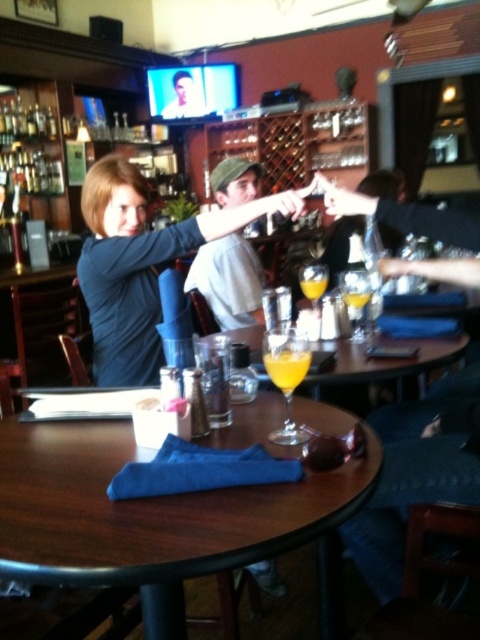
Which is in front, point (86, 284) or point (280, 369)?

Point (280, 369)

Who is more distant from viewer, [139,292] or [263,355]?

Point [139,292]

The height and width of the screenshot is (640, 480). I want to click on matte blue shirt at center, so click(140, 266).

Is point (127, 349) farther from viewer compared to point (240, 310)?

That is False.

Describe the element at coordinates (140, 266) in the screenshot. I see `matte blue shirt at center` at that location.

Who is more forward, (101, 330) or (231, 193)?

Point (101, 330) is more forward.

Image resolution: width=480 pixels, height=640 pixels. I want to click on matte blue shirt at center, so click(140, 266).

Is translucent glass at table center positioned behind orange liquid glass at table center?

No, translucent glass at table center is closer to the viewer.

Does translucent glass at table center have a greater width compared to orange liquid glass at table center?

Incorrect, translucent glass at table center's width does not surpass orange liquid glass at table center's.

Measure the distance between translucent glass at table center and camera.

The distance of translucent glass at table center from camera is 1.21 meters.

Where is `translucent glass at table center`? This screenshot has height=640, width=480. translucent glass at table center is located at coordinates (287, 368).